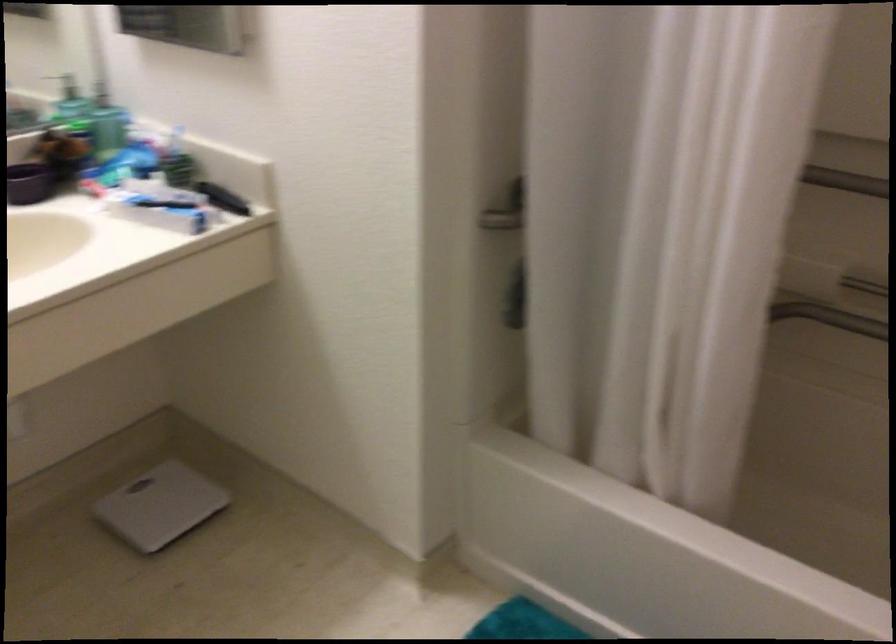
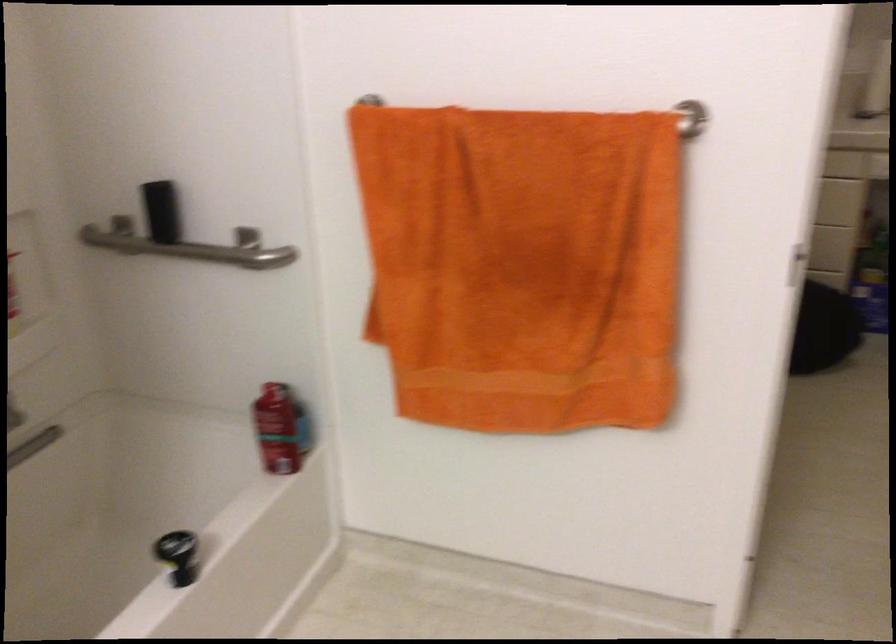
Based on the continuous images, in which direction is the camera rotating?

The camera's rotation is toward right-down.